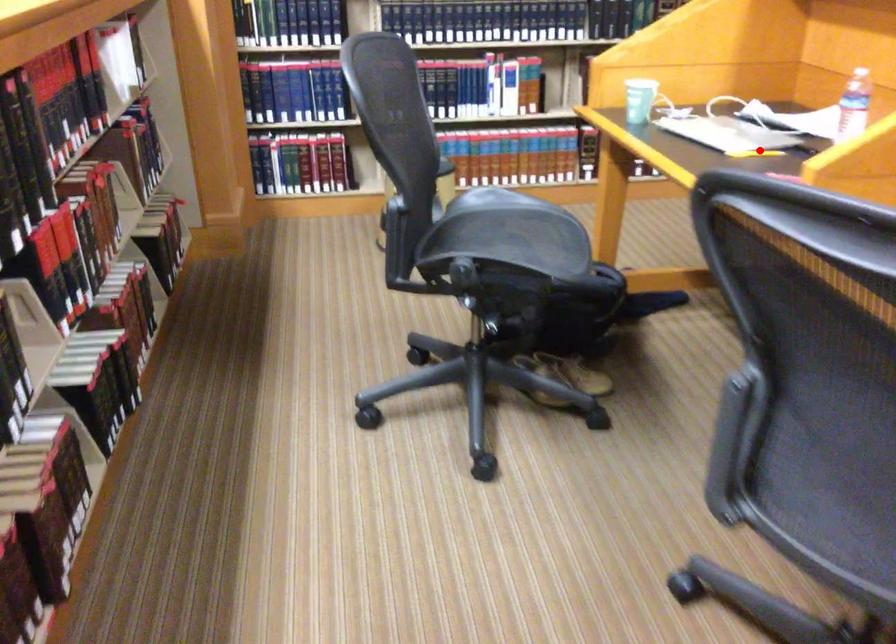
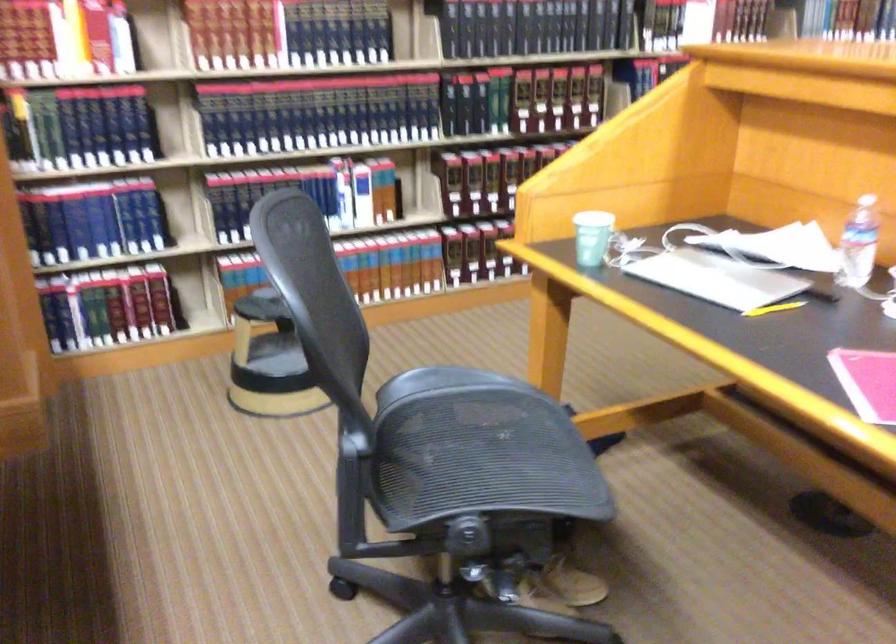
The point at the highlighted location is marked in the first image. Where is the corresponding point in the second image?

(774, 307)